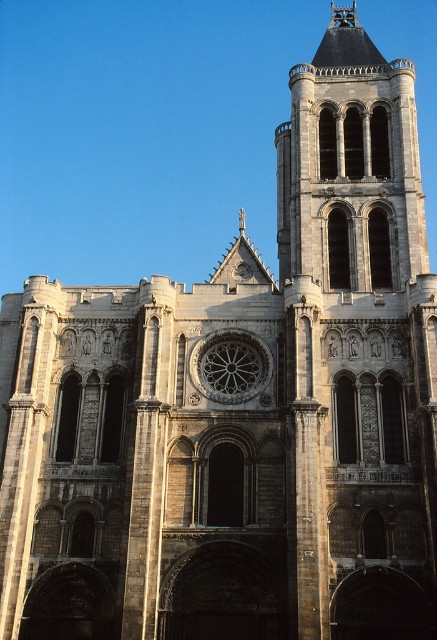
Question: Among these points, which one is nearest to the camera?

Choices:
 (A) (366, 456)
 (B) (239, 358)

Answer: (A)

Question: Is stone tower at right positioned in front of stone rose window at center?

Choices:
 (A) no
 (B) yes

Answer: (B)

Question: Which point is farther from the camera taking this photo?

Choices:
 (A) (294, 323)
 (B) (229, 380)

Answer: (B)

Question: Does stone tower at right appear under stone rose window at center?

Choices:
 (A) yes
 (B) no

Answer: (B)

Question: Does stone tower at right have a lesser width compared to stone rose window at center?

Choices:
 (A) yes
 (B) no

Answer: (B)